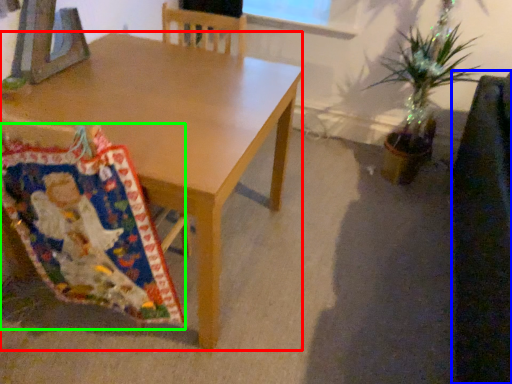
Question: Based on their relative distances, which object is farther from desk (highlighted by a red box)? Choose from swivel chair (highlighted by a blue box) and blanket (highlighted by a green box).

Choices:
 (A) swivel chair
 (B) blanket

Answer: (A)